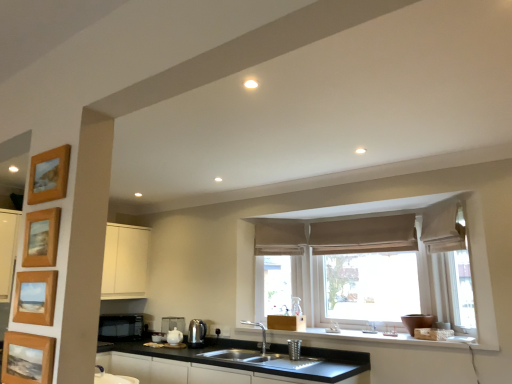
Question: Is beige fabric curtain at right wider or thinner than wooden framed picture at left, the 2th picture frame positioned from the bottom?

Choices:
 (A) wide
 (B) thin

Answer: (A)

Question: From the image's perspective, relative to wooden framed picture at left, the 3th picture frame in the top-to-bottom sequence, is beige fabric curtain at right above or below?

Choices:
 (A) above
 (B) below

Answer: (B)

Question: Which is farther from the wooden photo frame at left, which appears as the fourth picture frame when viewed from the top?

Choices:
 (A) white ceramic teapot at lower center, which is counted as the third appliance, starting from the front
 (B) wooden picture frame at upper left, which is the 4th picture frame from bottom to top
 (C) black matte cabinet at lower center
 (D) metallic silver cup at sink, the fourth appliance viewed from the left
 (E) brown fabric curtain at center, which is counted as the first curtain, starting from the left

Answer: (A)

Question: Estimate the real-world distances between objects in this image. Which object is closer to the wooden photo frame at left, which is counted as the 1th picture frame, starting from the bottom?

Choices:
 (A) metallic silver cup at sink, which appears as the first appliance when viewed from the front
 (B) satin silver kettle at lower center, which ranks as the 3th appliance in left-to-right order
 (C) beige fabric curtain at right
 (D) beige fabric window at center
 (E) wooden framed picture at left, the 3th picture frame in the top-to-bottom sequence

Answer: (E)